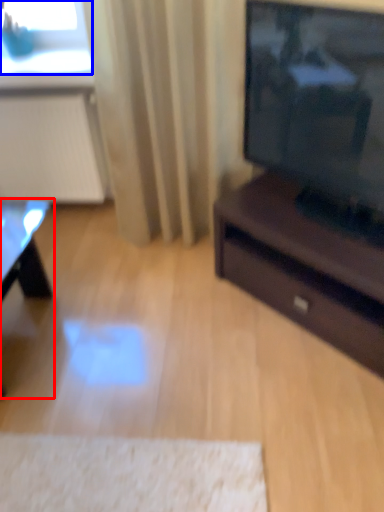
Question: Which point is closer to the camera, table (highlighted by a red box) or window screen (highlighted by a blue box)?

Choices:
 (A) table
 (B) window screen

Answer: (A)